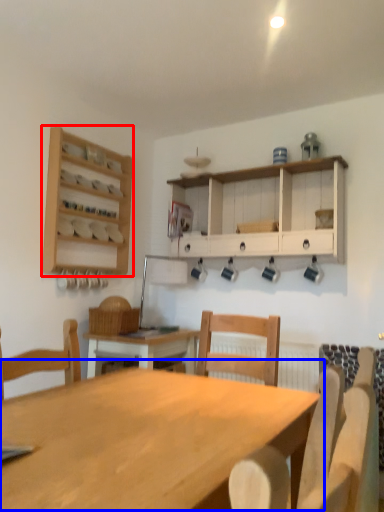
Question: Which point is closer to the camera, shelf (highlighted by a red box) or table (highlighted by a blue box)?

Choices:
 (A) shelf
 (B) table

Answer: (B)